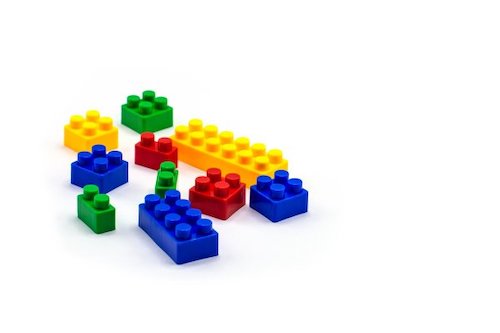
The image size is (500, 333). Find the location of `plastic building blocks`. plastic building blocks is located at coordinates (271, 212), (239, 151), (224, 188), (181, 227), (168, 183), (158, 152), (149, 121), (104, 125), (102, 170), (96, 206).